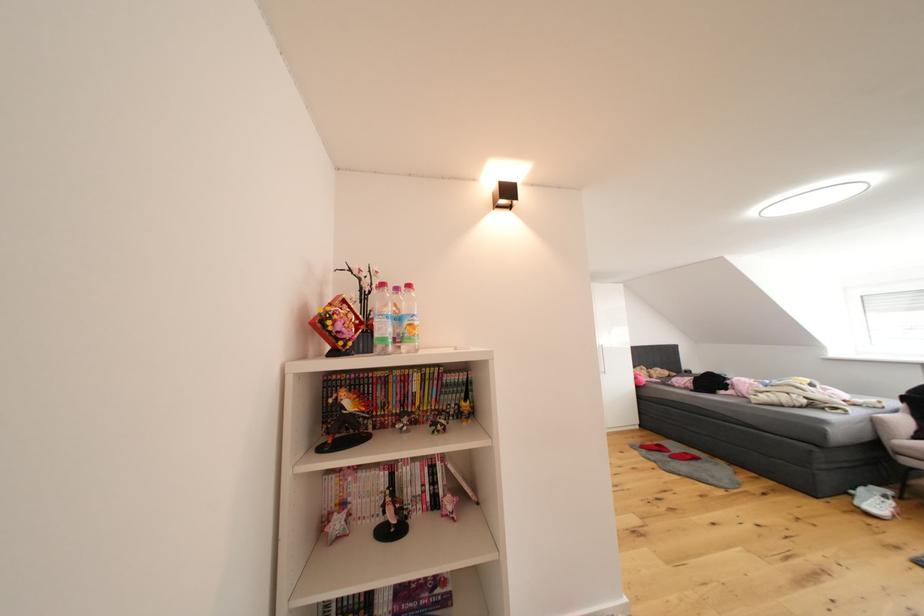
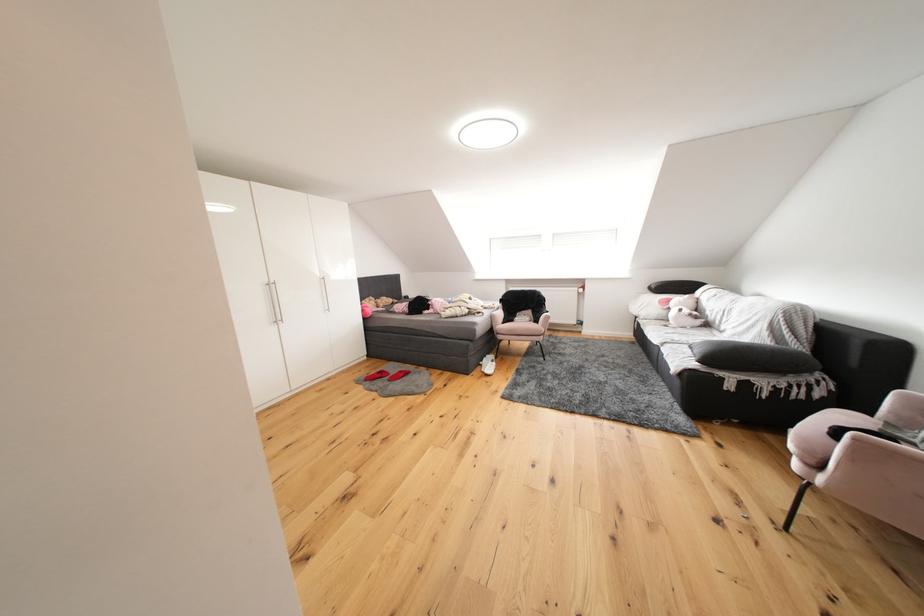
Question: The images are taken continuously from a first-person perspective. In which direction is your viewpoint rotating?

Choices:
 (A) Left
 (B) Right
 (C) Up
 (D) Down

Answer: (B)